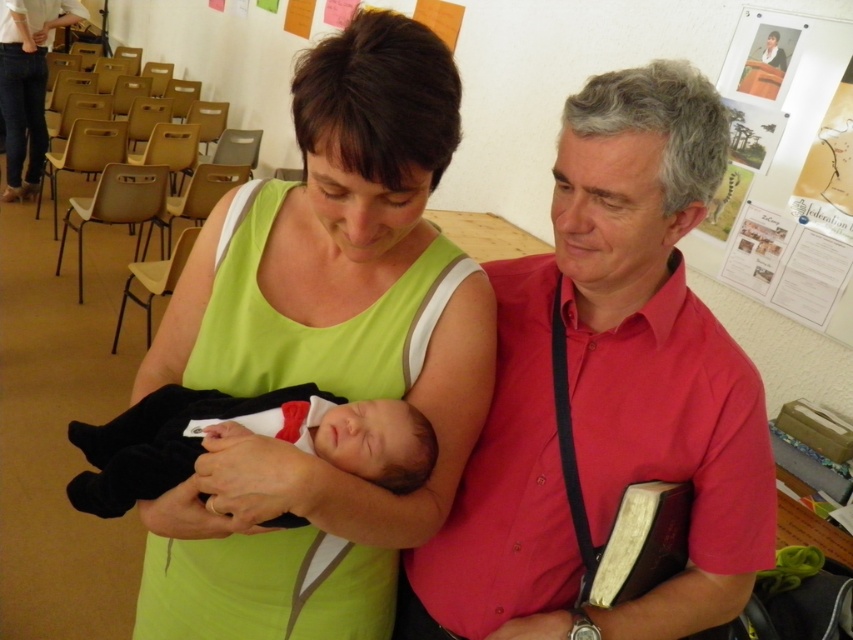
Does green fabric dress at center appear on the right side of black cotton newborn at center?

Indeed, green fabric dress at center is positioned on the right side of black cotton newborn at center.

Can you confirm if green fabric dress at center is positioned above black cotton newborn at center?

Indeed, green fabric dress at center is positioned over black cotton newborn at center.

Is point (350, 300) behind point (343, 468)?

Yes.

Image resolution: width=853 pixels, height=640 pixels. Identify the location of green fabric dress at center. (322, 349).

Can you confirm if green fabric dress at center is thinner than paper posters at upper right?

Incorrect, green fabric dress at center's width is not less than paper posters at upper right's.

Who is more forward, (209, 477) or (769, 115)?

Positioned in front is point (209, 477).

Is point (392, 534) more distant than point (746, 221)?

No, it is not.

This screenshot has height=640, width=853. Find the location of `green fabric dress at center`. green fabric dress at center is located at coordinates (322, 349).

Is pink cotton shirt at center to the right of paper posters at upper right from the viewer's perspective?

In fact, pink cotton shirt at center is to the left of paper posters at upper right.

Does point (723, 605) lie in front of point (815, 268)?

Yes, point (723, 605) is closer to viewer.

The image size is (853, 640). What are the coordinates of `pink cotton shirt at center` in the screenshot? It's located at (608, 388).